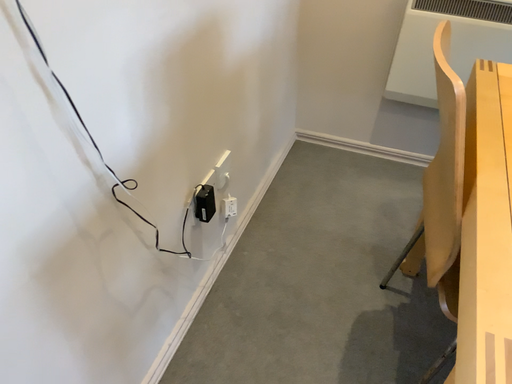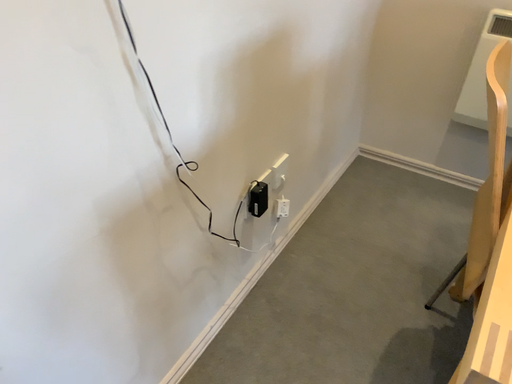
Question: How did the camera likely rotate when shooting the video?

Choices:
 (A) rotated left
 (B) rotated right

Answer: (A)